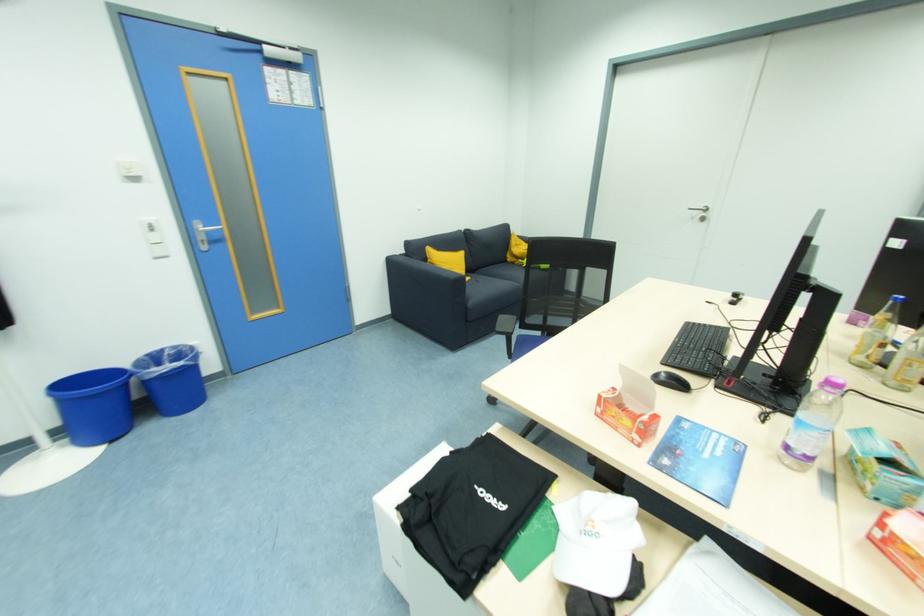
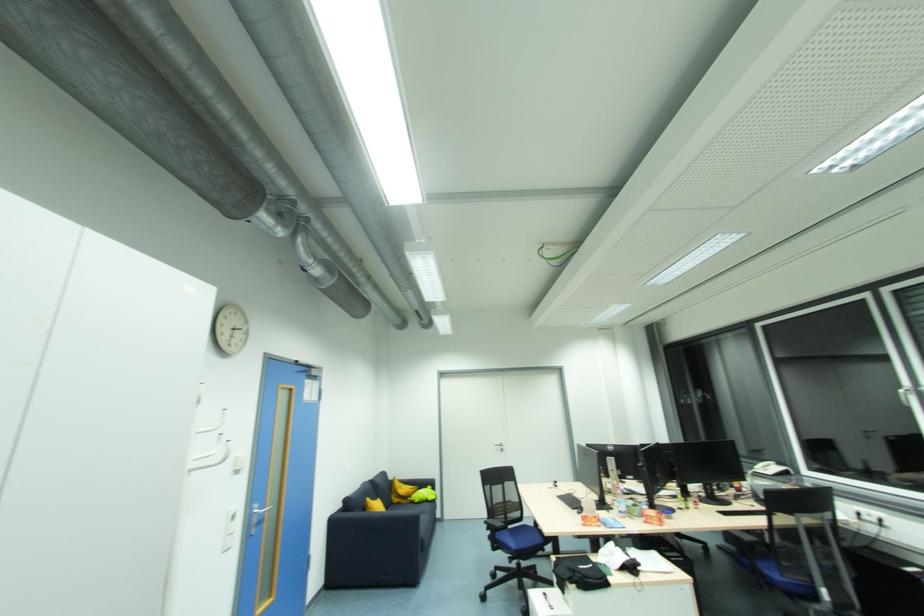
Where in the second image is the point corresponding to point 512,261 from the first image?

(397, 501)